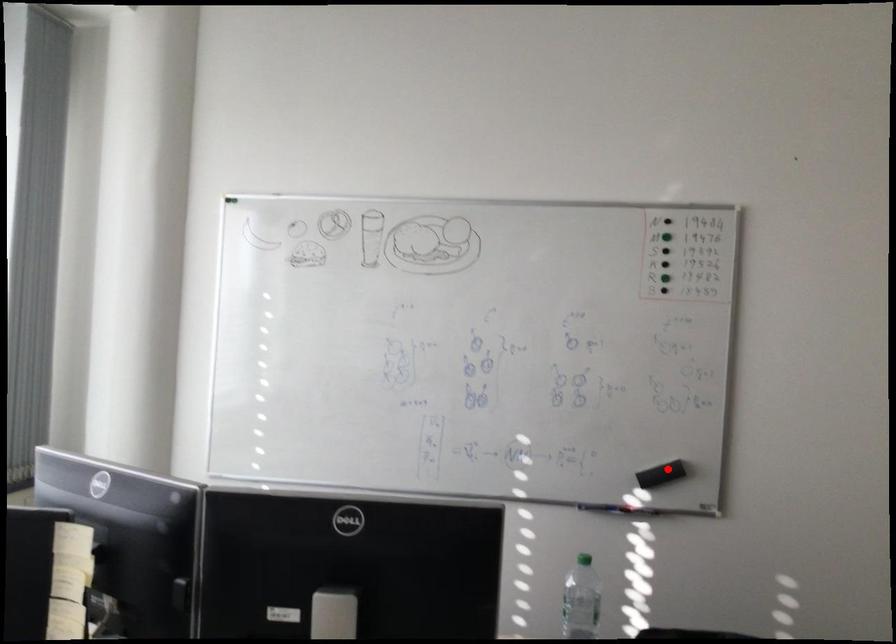
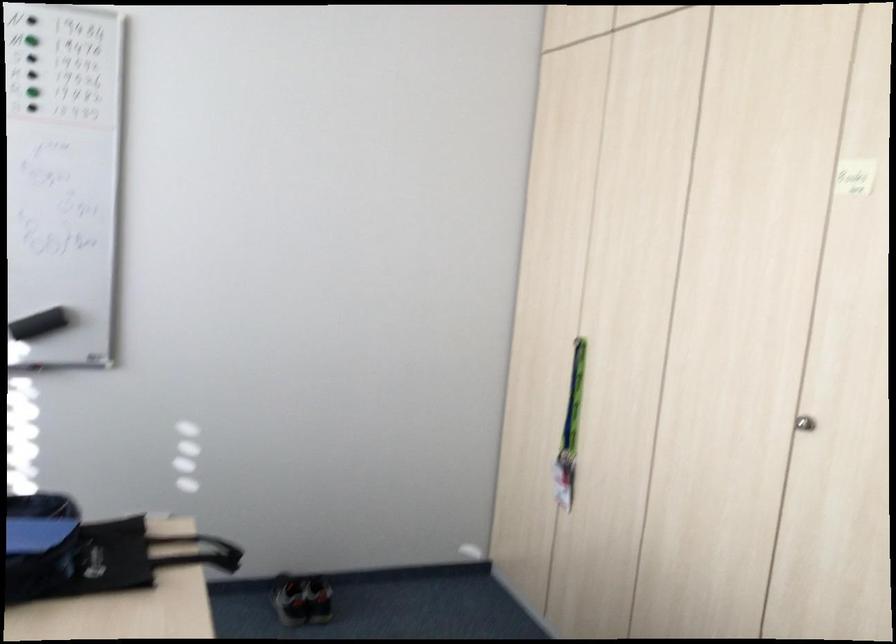
Where in the second image is the point corresponding to the highlighted location from the first image?

(39, 324)